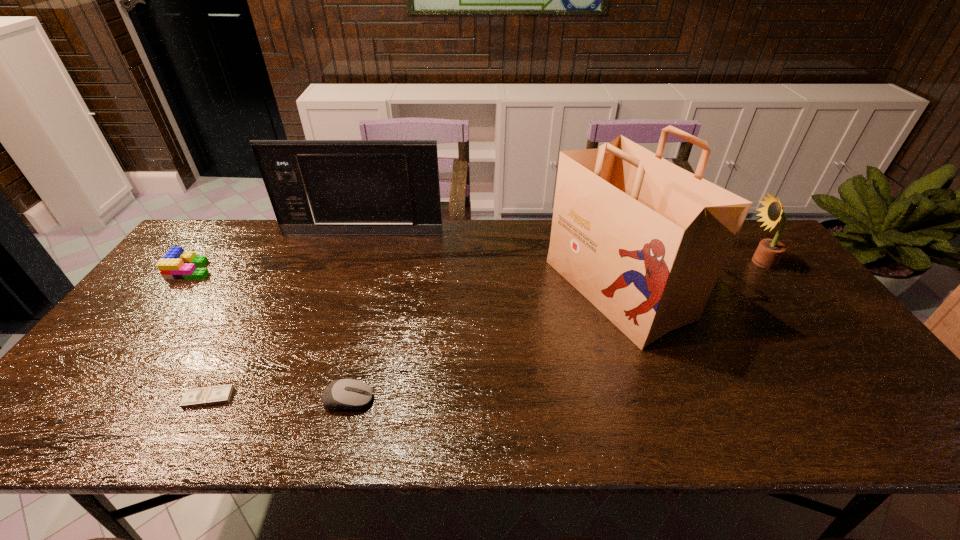
Locate an element on the screen. free location located on the side of the second object from right to left with the superhero design is located at coordinates (527, 289).

You are a GUI agent. You are given a task and a screenshot of the screen. Output one action in this format:
    pyautogui.click(x=<x>, y=<y>)
    Task: Click on the free location located 0.180m on the side of the second object from right to left with the superhero design
    
    Given the screenshot: What is the action you would take?
    pyautogui.click(x=489, y=289)

Where is `vacant space located 0.400m on the side of the second object from right to left with the superhero design`? This screenshot has height=540, width=960. vacant space located 0.400m on the side of the second object from right to left with the superhero design is located at coordinates (413, 289).

Find the location of a particular element. vacant space located on the front panel of the farthest object is located at coordinates (337, 311).

Where is `vacant space situated 0.300m on the face of the fourth shortest object`? vacant space situated 0.300m on the face of the fourth shortest object is located at coordinates (646, 262).

The image size is (960, 540). I want to click on vacant space located on the face of the fourth shortest object, so click(643, 262).

Locate an element on the screen. free space located on the face of the fourth shortest object is located at coordinates (701, 262).

The width and height of the screenshot is (960, 540). I want to click on free space located 0.100m on the front of the third shortest object, so click(166, 303).

Identify the location of vacant area located 0.100m on the wheel side of the second shortest object. Image resolution: width=960 pixels, height=540 pixels. (418, 400).

Identify the location of vacant space situated on the left of the shortest object. (129, 398).